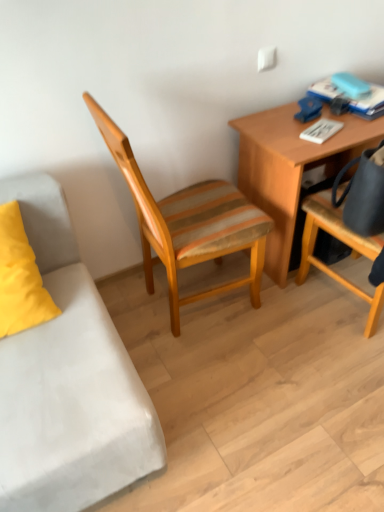
At what (x,y) coordinates should I click in order to perform the action: click on free spot below woodenchair at center, which is the second chair in right-to-left order (from a real-world perspective). Please return your answer as a coordinate pair (x, y). Looking at the image, I should click on (203, 303).